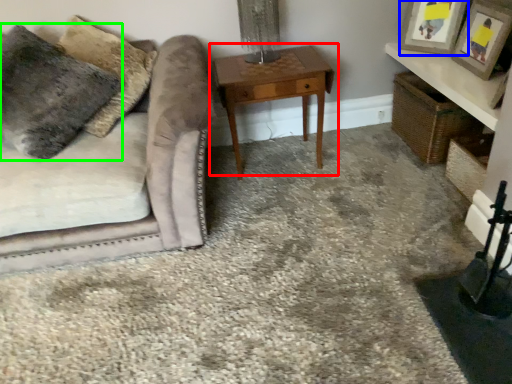
Question: Based on their relative distances, which object is nearer to table (highlighted by a red box)? Choose from picture frame (highlighted by a blue box) and pillow (highlighted by a green box).

Choices:
 (A) picture frame
 (B) pillow

Answer: (A)